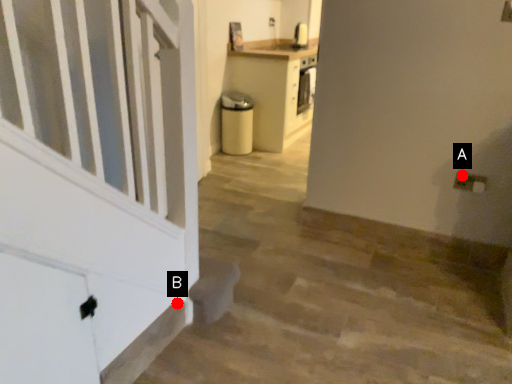
Question: Two points are circled on the image, labeled by A and B beside each circle. Which point appears closest to the camera in this image?

Choices:
 (A) A is closer
 (B) B is closer

Answer: (B)